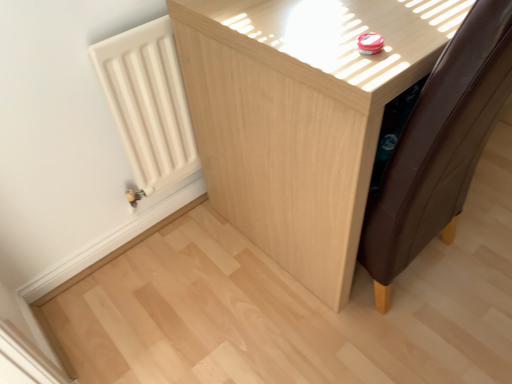
Question: Is light wood cabinet at center taller or shorter than white matte radiator at left?

Choices:
 (A) short
 (B) tall

Answer: (B)

Question: Which is correct: light wood cabinet at center is inside white matte radiator at left, or outside of it?

Choices:
 (A) outside
 (B) inside

Answer: (A)

Question: From a real-world perspective, is light wood cabinet at center positioned above or below white matte radiator at left?

Choices:
 (A) above
 (B) below

Answer: (B)

Question: From the image's perspective, is white matte radiator at left above or below light wood cabinet at center?

Choices:
 (A) below
 (B) above

Answer: (A)

Question: Would you say white matte radiator at left is to the left or to the right of light wood cabinet at center in the picture?

Choices:
 (A) left
 (B) right

Answer: (A)

Question: Based on their sizes in the image, would you say white matte radiator at left is bigger or smaller than light wood cabinet at center?

Choices:
 (A) big
 (B) small

Answer: (B)

Question: Is white matte radiator at left inside the boundaries of light wood cabinet at center, or outside?

Choices:
 (A) inside
 (B) outside

Answer: (B)